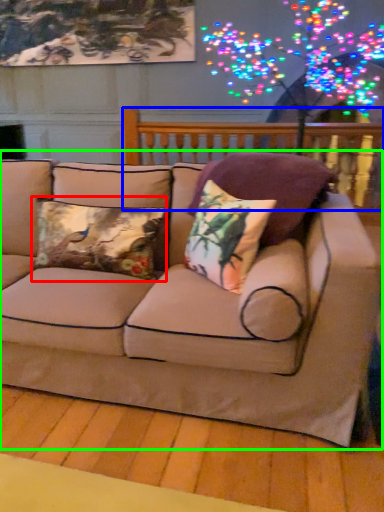
Question: Estimate the real-world distances between objects in this image. Which object is closer to pillow (highlighted by a red box), balustrade (highlighted by a blue box) or studio couch (highlighted by a green box)?

Choices:
 (A) balustrade
 (B) studio couch

Answer: (B)